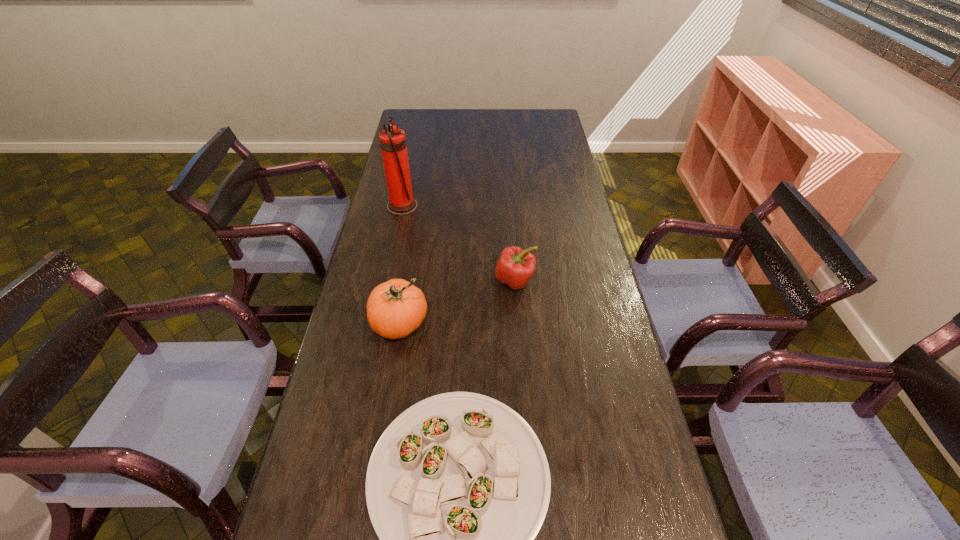
Where is `object that is the closest to the bell pepper`? This screenshot has height=540, width=960. object that is the closest to the bell pepper is located at coordinates (395, 308).

This screenshot has width=960, height=540. Identify the location of object that ranks as the second closest to the third shortest object. (515, 266).

The height and width of the screenshot is (540, 960). Find the location of `vacant space that satisfies the following two spatial constraints: 1. at the discharge end of the tallest object; 2. on the back side of the third farthest object`. vacant space that satisfies the following two spatial constraints: 1. at the discharge end of the tallest object; 2. on the back side of the third farthest object is located at coordinates (378, 323).

At what (x,y) coordinates should I click in order to perform the action: click on vacant point that satisfies the following two spatial constraints: 1. at the discharge end of the third tallest object; 2. on the left side of the fire extinguisher. Please return your answer as a coordinate pair (x, y). This screenshot has height=540, width=960. Looking at the image, I should click on (387, 281).

At what (x,y) coordinates should I click in order to perform the action: click on vacant space that satisfies the following two spatial constraints: 1. at the discharge end of the fire extinguisher; 2. on the left side of the third farthest object. Please return your answer as a coordinate pair (x, y). The image size is (960, 540). Looking at the image, I should click on (378, 323).

Locate an element on the screen. The height and width of the screenshot is (540, 960). free space that satisfies the following two spatial constraints: 1. on the back side of the pumpkin; 2. at the discharge end of the farthest object is located at coordinates coord(419,206).